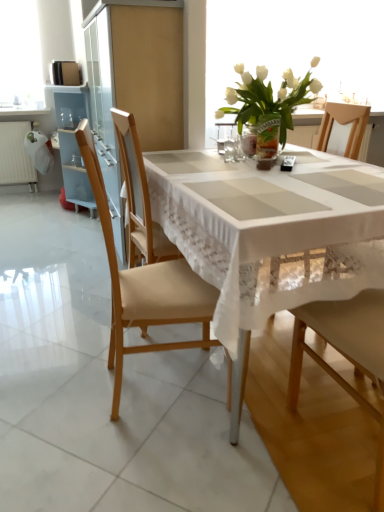
Question: From the image's perspective, relative to translucent glass vase at center, is light brown wood chair at left, the first chair when ordered from left to right, above or below?

Choices:
 (A) above
 (B) below

Answer: (B)

Question: Does point (152, 309) appear closer or farther from the camera than point (279, 135)?

Choices:
 (A) farther
 (B) closer

Answer: (B)

Question: Estimate the real-world distances between objects in this image. Which object is farther from the white painted radiator at left?

Choices:
 (A) clear glass vase at center, which appears as the first tableware when viewed from the right
 (B) white lace tablecloth at center
 (C) white glass vase at upper center
 (D) white glass vase at upper center
 (E) translucent glass vase at center, which is counted as the 1th tableware, starting from the left

Answer: (B)

Question: Estimate the real-world distances between objects in this image. Which object is farther from the white painted radiator at left?

Choices:
 (A) clear glass vase at center, the second tableware viewed from the left
 (B) translucent glass vase at center, which appears as the 2th tableware when viewed from the right
 (C) white glass vase at upper center
 (D) wooden chair at center, marked as the first chair in a right-to-left arrangement
 (E) translucent glass vase at center

Answer: (D)